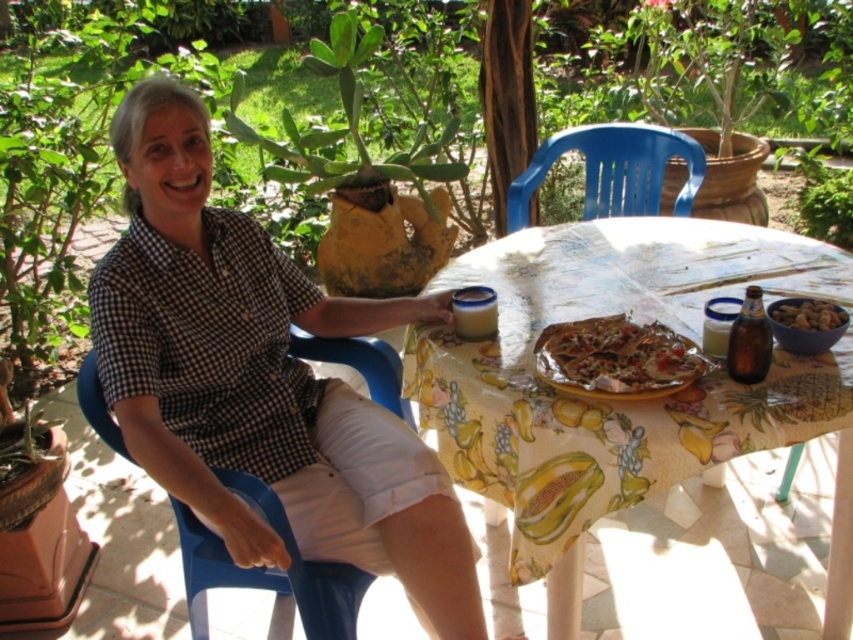
Does yellow printed tablecloth at center have a greater height compared to blue plastic chair at left?

Correct, yellow printed tablecloth at center is much taller as blue plastic chair at left.

Which of these two, yellow printed tablecloth at center or blue plastic chair at left, stands taller?

yellow printed tablecloth at center is taller.

Describe the element at coordinates (619, 401) in the screenshot. The height and width of the screenshot is (640, 853). I see `yellow printed tablecloth at center` at that location.

What are the coordinates of `yellow printed tablecloth at center` in the screenshot? It's located at pos(619,401).

Is checkered fabric shirt at center thinner than yellow printed tablecloth at center?

Yes.

The height and width of the screenshot is (640, 853). What do you see at coordinates (260, 380) in the screenshot?
I see `checkered fabric shirt at center` at bounding box center [260, 380].

Who is more forward, (167, 250) or (577, 486)?

Positioned in front is point (577, 486).

Image resolution: width=853 pixels, height=640 pixels. Identify the location of checkered fabric shirt at center. (260, 380).

Is yellow printed tablecloth at center bigger than blue plastic chair at upper center?

Yes, yellow printed tablecloth at center is bigger than blue plastic chair at upper center.

Who is more forward, (834, 296) or (625, 144)?

Positioned in front is point (834, 296).

Locate an element on the screen. This screenshot has height=640, width=853. yellow printed tablecloth at center is located at coordinates (619, 401).